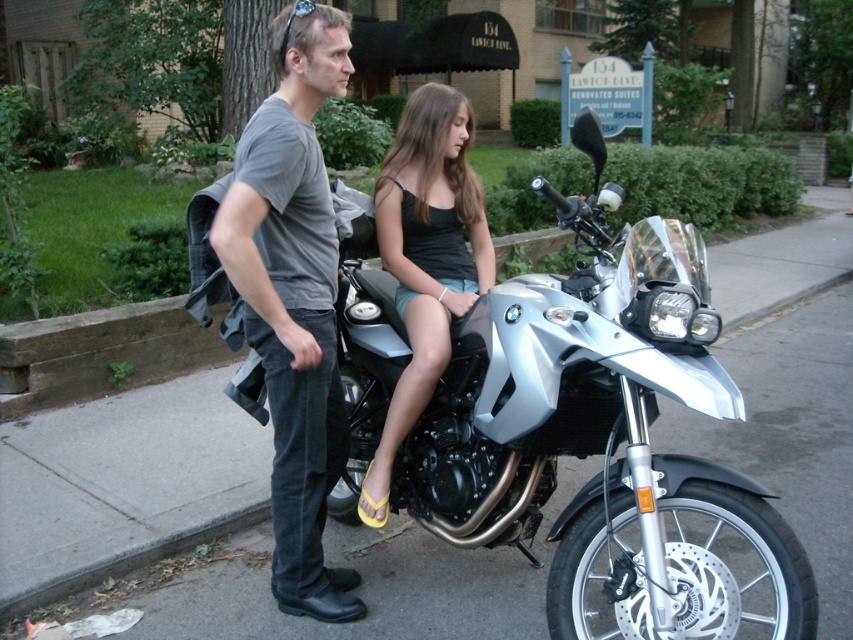
Which is more to the left, silver metallic motorcycle at center or gray cotton t-shirt at center?

Positioned to the left is gray cotton t-shirt at center.

This screenshot has width=853, height=640. What are the coordinates of `silver metallic motorcycle at center` in the screenshot? It's located at (605, 438).

You are a GUI agent. You are given a task and a screenshot of the screen. Output one action in this format:
    pyautogui.click(x=<x>, y=<y>)
    Task: Click on the silver metallic motorcycle at center
    The height and width of the screenshot is (640, 853).
    Given the screenshot: What is the action you would take?
    pyautogui.click(x=605, y=438)

How far apart are gray cotton t-shirt at center and black fabric tank top at center?

They are 19.57 inches apart.

Is point (326, 456) closer to camera compared to point (448, 260)?

Yes, it is in front of point (448, 260).

Which is behind, point (252, 316) or point (426, 323)?

Point (426, 323)

The height and width of the screenshot is (640, 853). I want to click on gray cotton t-shirt at center, so point(293,298).

Who is higher up, silver metallic motorcycle at center or black fabric tank top at center?

black fabric tank top at center

Can you confirm if silver metallic motorcycle at center is wider than black fabric tank top at center?

Correct, the width of silver metallic motorcycle at center exceeds that of black fabric tank top at center.

Between point (635, 596) and point (405, 196), which one is positioned behind?

Point (405, 196)

At what (x,y) coordinates should I click in order to perform the action: click on silver metallic motorcycle at center. Please return your answer as a coordinate pair (x, y). Looking at the image, I should click on (605, 438).